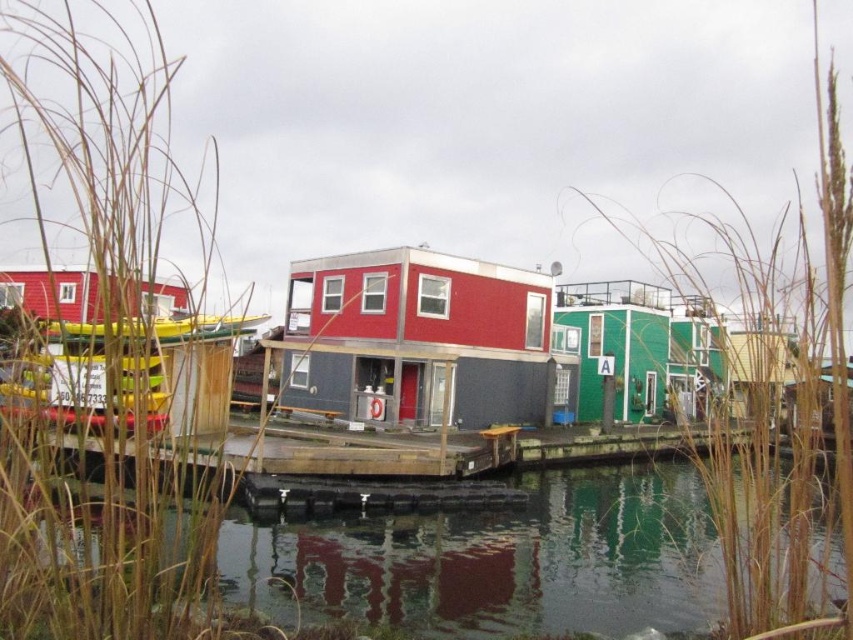
Which is behind, point (103, 184) or point (296, 438)?

The point (296, 438) is more distant.

Between brown grass at left and wooden dock at center, which one has more height?

Standing taller between the two is brown grass at left.

The width and height of the screenshot is (853, 640). I want to click on brown grass at left, so click(x=103, y=339).

Between matte red houseboat at center and wooden dock at center, which one appears on the right side from the viewer's perspective?

matte red houseboat at center

Does matte red houseboat at center appear on the left side of wooden dock at center?

Incorrect, matte red houseboat at center is not on the left side of wooden dock at center.

Is point (480, 284) closer to viewer compared to point (288, 468)?

That is False.

Locate an element on the screen. The image size is (853, 640). matte red houseboat at center is located at coordinates (421, 339).

Which is behind, point (706, 330) or point (13, 289)?

The point (706, 330) is more distant.

Measure the distance between point (x=614, y=413) and camera.

Point (x=614, y=413) and camera are 104.79 feet apart from each other.

The image size is (853, 640). What are the coordinates of `green matte houseboat at center-right` in the screenshot? It's located at (x=637, y=346).